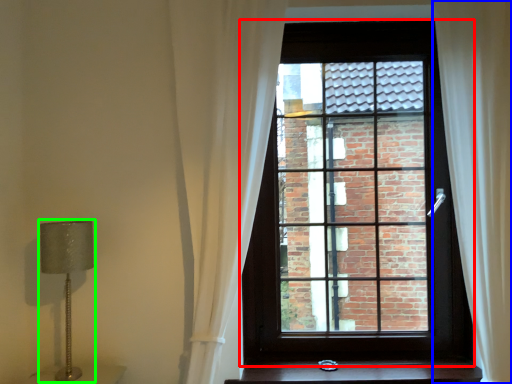
Question: Which object is the farthest from window (highlighted by a red box)? Choose among these: curtain (highlighted by a blue box) or table lamp (highlighted by a green box).

Choices:
 (A) curtain
 (B) table lamp

Answer: (B)